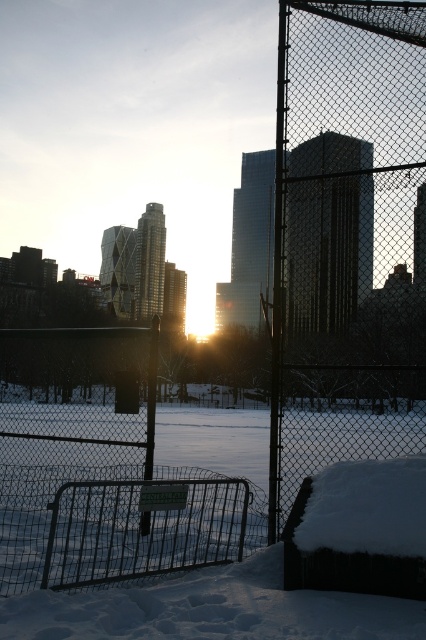
Question: Which point is farther from the camera taking this photo?

Choices:
 (A) (77, 515)
 (B) (333, 264)

Answer: (A)

Question: Considering the relative positions of wire mesh fence at center and metallic chain-link fence at center in the image provided, where is wire mesh fence at center located with respect to metallic chain-link fence at center?

Choices:
 (A) below
 (B) above

Answer: (B)

Question: Which object is farther from the camera taking this photo?

Choices:
 (A) wire mesh fence at center
 (B) metallic chain-link fence at center

Answer: (A)

Question: Can you confirm if wire mesh fence at center is positioned to the right of metallic chain-link fence at center?

Choices:
 (A) yes
 (B) no

Answer: (A)

Question: Is wire mesh fence at center wider than metallic chain-link fence at center?

Choices:
 (A) yes
 (B) no

Answer: (B)